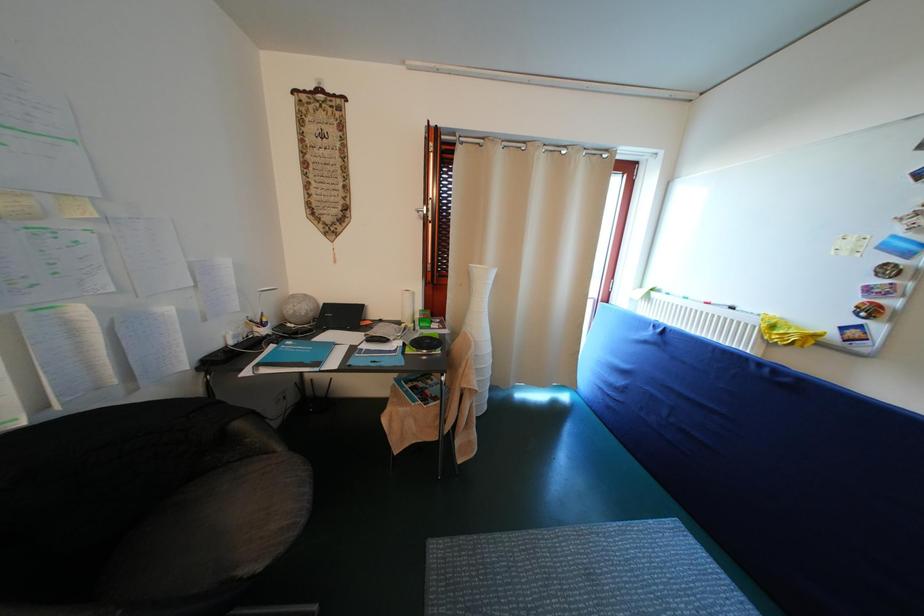
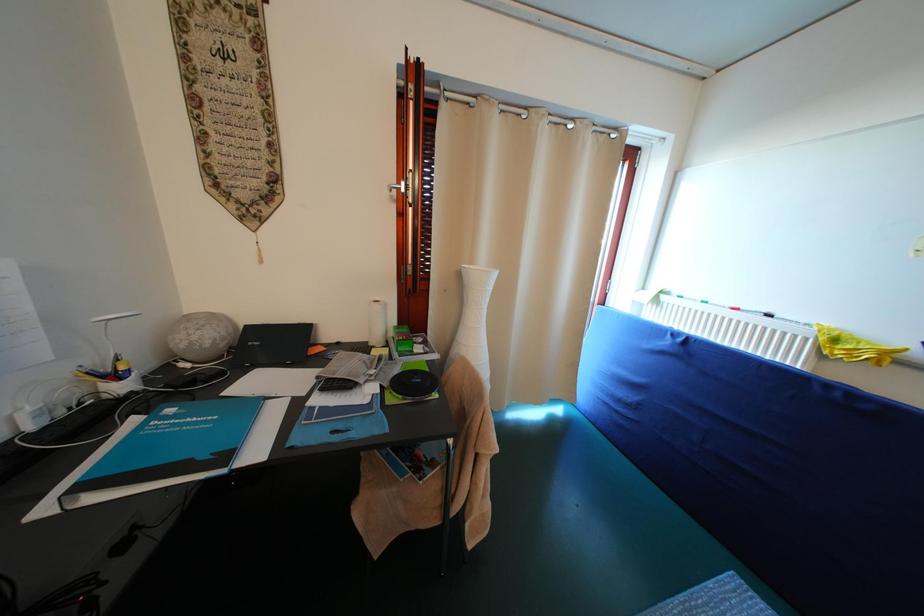
The images are taken continuously from a first-person perspective. In which direction are you moving?

The cameraman walked toward left, forward.